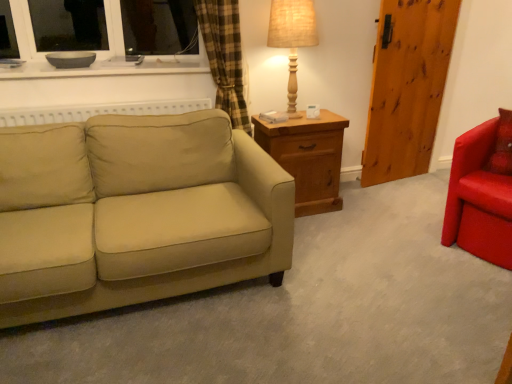
Question: Is burlap fabric table lamp at upper right turned away from wooden nightstand at center?

Choices:
 (A) yes
 (B) no

Answer: (B)

Question: Does burlap fabric table lamp at upper right turn towards wooden nightstand at center?

Choices:
 (A) yes
 (B) no

Answer: (B)

Question: Is burlap fabric table lamp at upper right positioned beyond the bounds of wooden nightstand at center?

Choices:
 (A) no
 (B) yes

Answer: (B)

Question: Does burlap fabric table lamp at upper right contain wooden nightstand at center?

Choices:
 (A) yes
 (B) no

Answer: (B)

Question: Considering the relative sizes of burlap fabric table lamp at upper right and wooden nightstand at center in the image provided, is burlap fabric table lamp at upper right shorter than wooden nightstand at center?

Choices:
 (A) no
 (B) yes

Answer: (A)

Question: Is the position of burlap fabric table lamp at upper right less distant than that of wooden nightstand at center?

Choices:
 (A) no
 (B) yes

Answer: (B)

Question: From a real-world perspective, is shiny red armchair at right under burlap fabric table lamp at upper right?

Choices:
 (A) yes
 (B) no

Answer: (A)

Question: Does shiny red armchair at right lie behind burlap fabric table lamp at upper right?

Choices:
 (A) yes
 (B) no

Answer: (B)

Question: From a real-world perspective, is shiny red armchair at right physically above burlap fabric table lamp at upper right?

Choices:
 (A) no
 (B) yes

Answer: (A)

Question: Is shiny red armchair at right oriented towards burlap fabric table lamp at upper right?

Choices:
 (A) yes
 (B) no

Answer: (B)

Question: From the image's perspective, is shiny red armchair at right beneath burlap fabric table lamp at upper right?

Choices:
 (A) no
 (B) yes

Answer: (B)

Question: Is shiny red armchair at right positioned before burlap fabric table lamp at upper right?

Choices:
 (A) no
 (B) yes

Answer: (B)

Question: From the image's perspective, would you say wooden nightstand at center is shown under white glossy bowl at upper left?

Choices:
 (A) yes
 (B) no

Answer: (A)